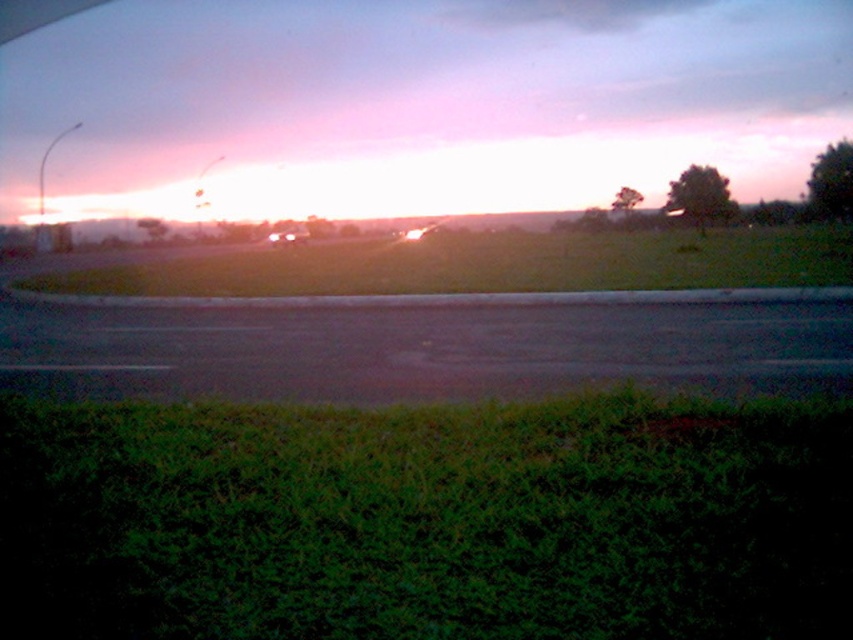
Question: Which point is closer to the camera taking this photo?

Choices:
 (A) (300, 237)
 (B) (360, 364)

Answer: (B)

Question: In this image, where is black asphalt highway at center located relative to matte black car at center?

Choices:
 (A) right
 (B) left

Answer: (A)

Question: Which point appears closest to the camera in this image?

Choices:
 (A) (793, 328)
 (B) (277, 240)

Answer: (A)

Question: Which point is closer to the camera taking this photo?

Choices:
 (A) (x=296, y=237)
 (B) (x=398, y=314)

Answer: (B)

Question: Can you confirm if black asphalt highway at center is positioned to the right of matte black car at center?

Choices:
 (A) no
 (B) yes

Answer: (B)

Question: Is the position of black asphalt highway at center less distant than that of matte black car at center?

Choices:
 (A) no
 (B) yes

Answer: (B)